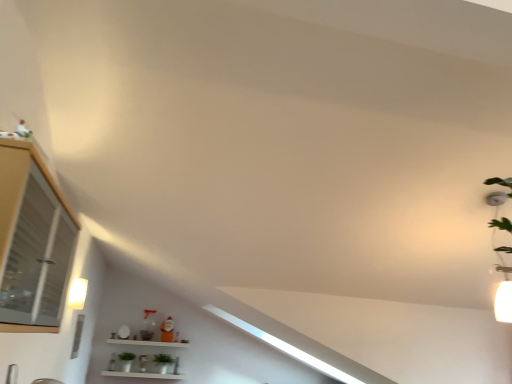
Question: Is green matte plant at lower center located within matte glass cabinet at left?

Choices:
 (A) no
 (B) yes

Answer: (A)

Question: Is matte glass cabinet at left at the left side of green matte plant at lower center?

Choices:
 (A) no
 (B) yes

Answer: (A)

Question: Is matte glass cabinet at left beside green matte plant at lower center?

Choices:
 (A) no
 (B) yes

Answer: (A)

Question: Is matte glass cabinet at left oriented towards green matte plant at lower center?

Choices:
 (A) yes
 (B) no

Answer: (B)

Question: Does matte glass cabinet at left come in front of green matte plant at lower center?

Choices:
 (A) yes
 (B) no

Answer: (A)

Question: Is green matte plant at lower center spatially inside white glossy shelf at lower center, or outside of it?

Choices:
 (A) outside
 (B) inside

Answer: (B)

Question: Is point (172, 360) positioned closer to the camera than point (139, 344)?

Choices:
 (A) closer
 (B) farther

Answer: (B)

Question: From the image's perspective, is green matte plant at lower center above or below white glossy shelf at lower center?

Choices:
 (A) below
 (B) above

Answer: (A)

Question: In terms of size, does green matte plant at lower center appear bigger or smaller than white glossy shelf at lower center?

Choices:
 (A) big
 (B) small

Answer: (B)

Question: In terms of width, does matte glass cabinet at left look wider or thinner when compared to matte white light fixture at left?

Choices:
 (A) thin
 (B) wide

Answer: (B)

Question: Looking at the image, does matte glass cabinet at left seem bigger or smaller compared to matte white light fixture at left?

Choices:
 (A) small
 (B) big

Answer: (B)

Question: Relative to matte white light fixture at left, is matte glass cabinet at left in front or behind?

Choices:
 (A) behind
 (B) front

Answer: (B)

Question: Is matte glass cabinet at left situated inside matte white light fixture at left or outside?

Choices:
 (A) outside
 (B) inside

Answer: (A)

Question: Do you think white glossy shelf at lower center is within matte white light fixture at left, or outside of it?

Choices:
 (A) outside
 (B) inside

Answer: (A)

Question: Is white glossy shelf at lower center taller or shorter than matte white light fixture at left?

Choices:
 (A) short
 (B) tall

Answer: (B)